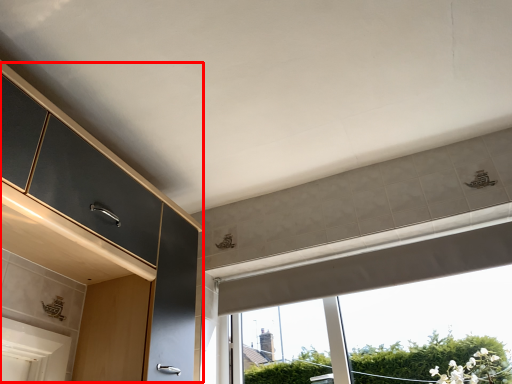
Question: Considering the relative positions of dresser (annotated by the red box) and window in the image provided, where is dresser (annotated by the red box) located with respect to the staircase?

Choices:
 (A) right
 (B) left

Answer: (B)